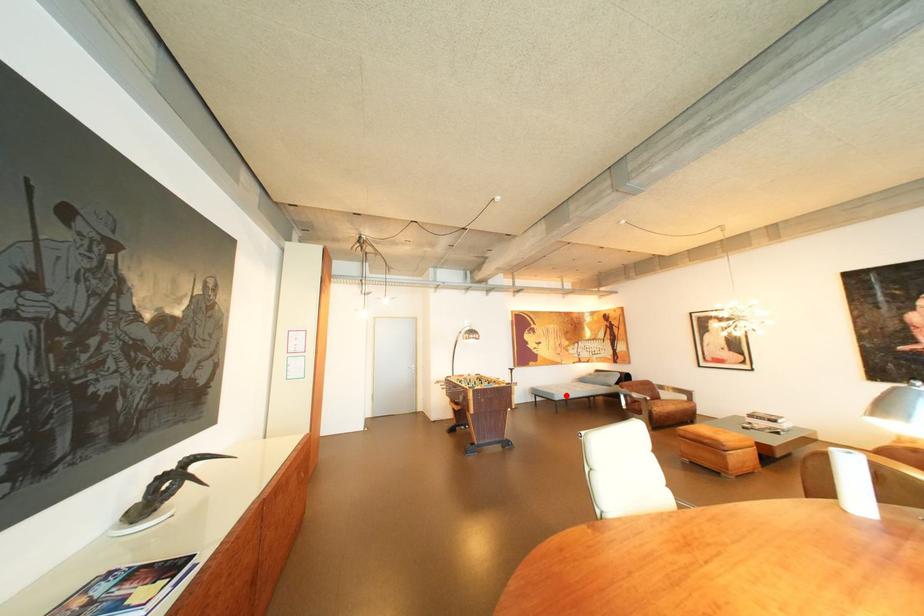
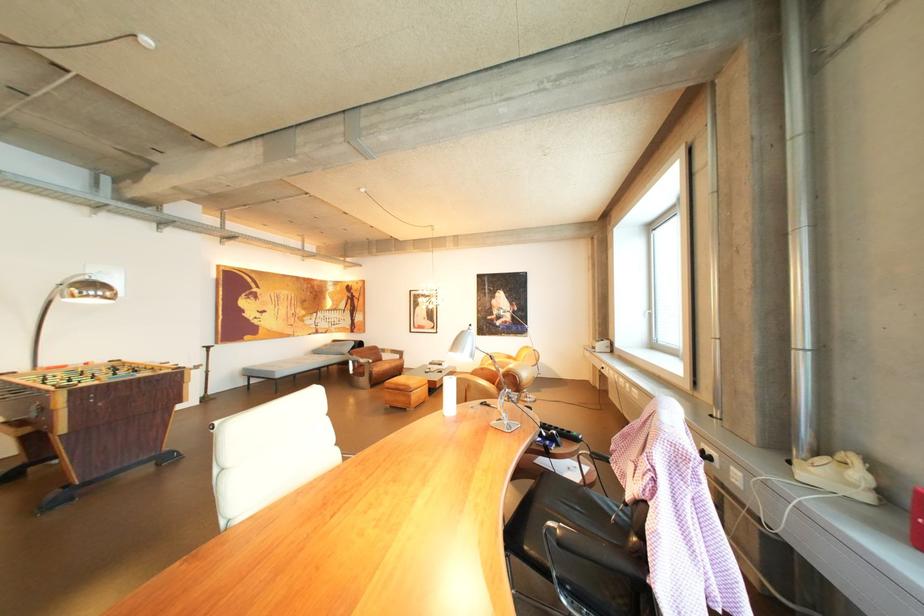
Where in the second image is the point corresponding to the highlighted location from the first image?

(286, 373)